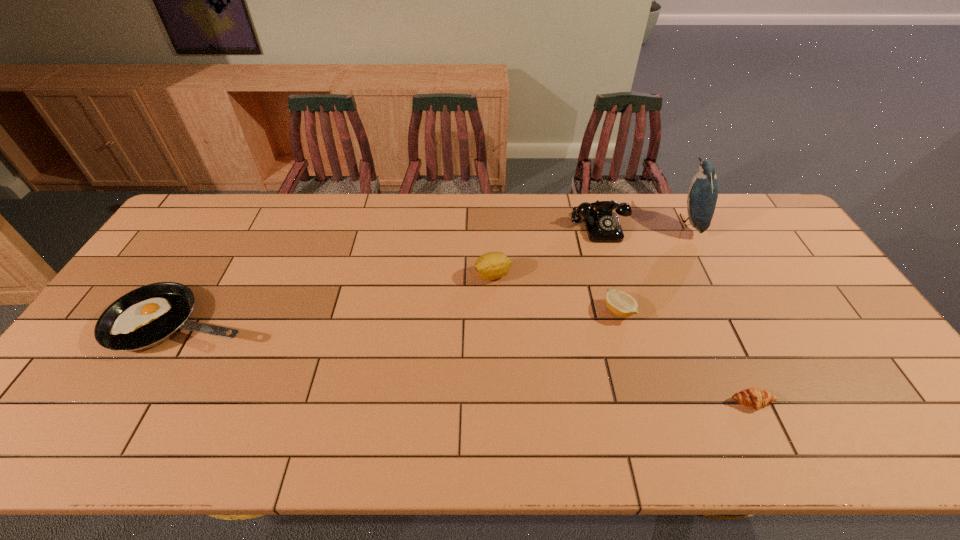
At what (x,y) coordinates should I click in order to perform the action: click on vacant region located 0.380m at the tip of the tallest object's beak. Please return your answer as a coordinate pair (x, y). The image size is (960, 540). Looking at the image, I should click on (566, 221).

The width and height of the screenshot is (960, 540). I want to click on vacant space located at the tip of the tallest object's beak, so click(x=631, y=221).

Where is `vacant space situated 0.330m on the dial of the telephone`? Image resolution: width=960 pixels, height=540 pixels. vacant space situated 0.330m on the dial of the telephone is located at coordinates (628, 323).

You are a GUI agent. You are given a task and a screenshot of the screen. Output one action in this format:
    pyautogui.click(x=<x>, y=<y>)
    Task: Click on the blank area located 0.070m at the stem end of the taller lemon
    Image resolution: width=960 pixels, height=540 pixels.
    Given the screenshot: What is the action you would take?
    pyautogui.click(x=451, y=275)

Find the location of a particular element. blank space located 0.330m at the stem end of the taller lemon is located at coordinates (365, 275).

The height and width of the screenshot is (540, 960). Identify the location of free space located 0.090m at the stem end of the taller lemon. (444, 275).

Find the location of a particular element. vacant area situated on the front of the frying pan is located at coordinates (144, 387).

Image resolution: width=960 pixels, height=540 pixels. I want to click on blank space located on the front of the shorter lemon, so click(x=656, y=442).

Where is `vacant space located 0.080m on the front-facing side of the nearest object`? This screenshot has height=540, width=960. vacant space located 0.080m on the front-facing side of the nearest object is located at coordinates (772, 446).

Identify the location of bird that is at the far edge. The width and height of the screenshot is (960, 540). (703, 191).